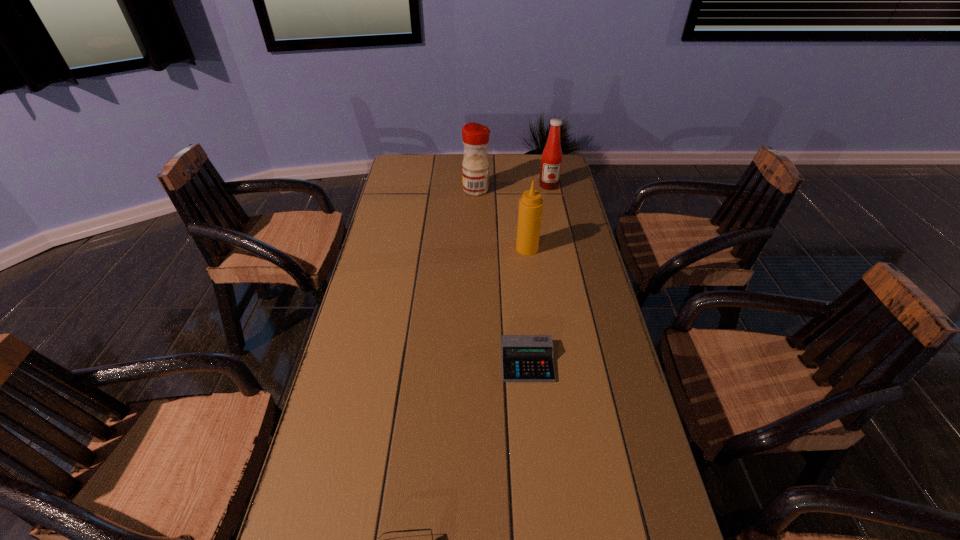
Find the location of a particular element. Image resolution: width=960 pixels, height=540 pixels. object present at the right edge is located at coordinates (549, 178).

Find the location of a particular element. object located at the far right corner is located at coordinates (549, 178).

Image resolution: width=960 pixels, height=540 pixels. I want to click on vacant space at the far edge, so click(x=504, y=155).

The height and width of the screenshot is (540, 960). In order to click on blank space at the left edge in this screenshot , I will do `click(420, 213)`.

Image resolution: width=960 pixels, height=540 pixels. I want to click on vacant point at the right edge, so tap(574, 368).

In the image, there is a desktop. Where is `vacant space at the far left corner`? The height and width of the screenshot is (540, 960). vacant space at the far left corner is located at coordinates [x=416, y=179].

You are a GUI agent. You are given a task and a screenshot of the screen. Output one action in this format:
    pyautogui.click(x=<x>, y=<y>)
    Task: Click on the vacant region at the far right corner of the desktop
    This screenshot has width=960, height=540.
    Given the screenshot: What is the action you would take?
    pyautogui.click(x=540, y=156)

Locate an element on the screen. The height and width of the screenshot is (540, 960). free space that is in between the calculator and the third nearest object is located at coordinates [x=527, y=305].

At what (x,y) coordinates should I click in order to perform the action: click on empty space between the calculator and the second object from left to right. Please return your answer as a coordinate pair (x, y). The width and height of the screenshot is (960, 540). Looking at the image, I should click on (502, 276).

Locate an element on the screen. The width and height of the screenshot is (960, 540). free space between the nearest condiment and the calculator is located at coordinates (527, 305).